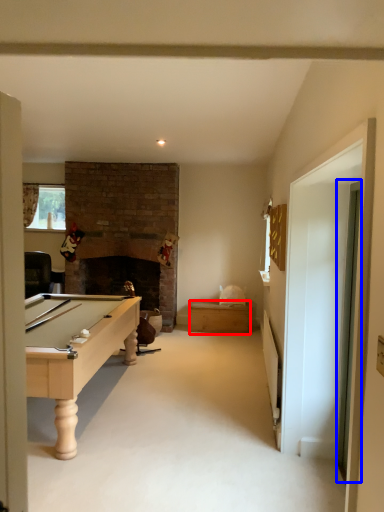
Question: Which object appears closest to the camera in this image, drawer (highlighted by a red box) or glass door (highlighted by a blue box)?

Choices:
 (A) drawer
 (B) glass door

Answer: (B)